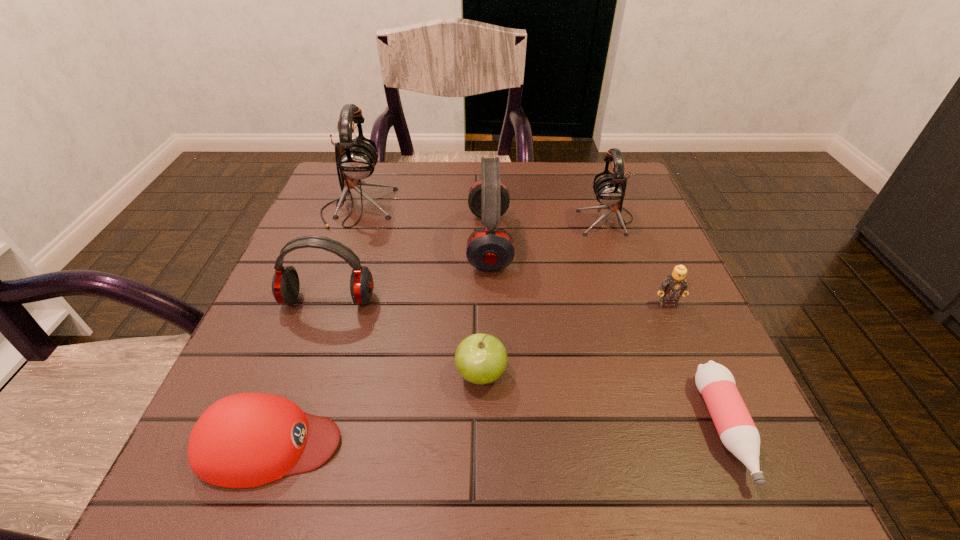
Identify the location of vacant area situated in front of the tan Lego. Image resolution: width=960 pixels, height=540 pixels. (720, 426).

The width and height of the screenshot is (960, 540). I want to click on free space located 0.310m on the front-facing side of the baseball cap, so click(557, 444).

Locate an element on the screen. The width and height of the screenshot is (960, 540). baseball cap present at the near edge is located at coordinates (245, 440).

You are a GUI agent. You are given a task and a screenshot of the screen. Output one action in this format:
    pyautogui.click(x=<x>, y=<y>)
    Task: Click on the bottle situated at the near edge
    
    Given the screenshot: What is the action you would take?
    pyautogui.click(x=737, y=431)

In order to click on baseball cap that is at the left edge in this screenshot , I will do [x=245, y=440].

Locate an element on the screen. The image size is (960, 540). earphone that is at the right edge is located at coordinates (609, 189).

The height and width of the screenshot is (540, 960). Identify the location of Lego that is positioned at the right edge. (675, 285).

You are a GUI agent. You are given a task and a screenshot of the screen. Output one action in this format:
    pyautogui.click(x=<x>, y=<y>)
    Task: Click on the bottle that is at the right edge
    
    Given the screenshot: What is the action you would take?
    pyautogui.click(x=737, y=431)

The image size is (960, 540). Find the location of `object positioned at the far left corner`. object positioned at the far left corner is located at coordinates (356, 159).

You are a GUI agent. You are given a task and a screenshot of the screen. Output one action in this format:
    pyautogui.click(x=<x>, y=<y>)
    Task: Click on the object that is at the near left corner
    
    Given the screenshot: What is the action you would take?
    pyautogui.click(x=245, y=440)